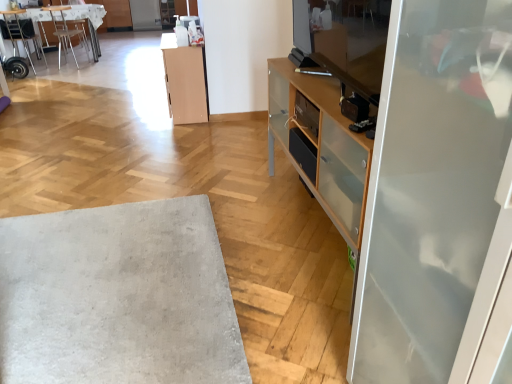
Question: Is clear glass screen door at upper center, which is the 1th screen door in back-to-front order, wider than wooden textured desk at upper left?

Choices:
 (A) yes
 (B) no

Answer: (A)

Question: From a real-world perspective, is clear glass screen door at upper center, which is the second screen door in right-to-left order, located beneath wooden textured desk at upper left?

Choices:
 (A) no
 (B) yes

Answer: (B)

Question: Is clear glass screen door at upper center, acting as the first screen door starting from the left, at the right side of wooden textured desk at upper left?

Choices:
 (A) no
 (B) yes

Answer: (B)

Question: Is clear glass screen door at upper center, which is the 1th screen door in back-to-front order, positioned beyond the bounds of wooden textured desk at upper left?

Choices:
 (A) yes
 (B) no

Answer: (A)

Question: Is clear glass screen door at upper center, marked as the 2th screen door in a front-to-back arrangement, beside wooden textured desk at upper left?

Choices:
 (A) no
 (B) yes

Answer: (A)

Question: Is wooden textured desk at upper left wider or thinner than metallic silver chair at upper left, the 2th chair positioned from the right?

Choices:
 (A) wide
 (B) thin

Answer: (A)

Question: Looking at the image, does wooden textured desk at upper left seem bigger or smaller compared to metallic silver chair at upper left, the 2th chair positioned from the right?

Choices:
 (A) big
 (B) small

Answer: (A)

Question: Considering their positions, is wooden textured desk at upper left located in front of or behind metallic silver chair at upper left, the first chair viewed from the left?

Choices:
 (A) behind
 (B) front

Answer: (A)

Question: Do you think wooden textured desk at upper left is within metallic silver chair at upper left, the 2th chair positioned from the right, or outside of it?

Choices:
 (A) inside
 (B) outside

Answer: (B)

Question: In terms of size, does metallic silver chair at upper left, which ranks as the first chair in right-to-left order, appear bigger or smaller than light wood cabinet at center?

Choices:
 (A) small
 (B) big

Answer: (A)

Question: From the image's perspective, is metallic silver chair at upper left, which ranks as the 2th chair in left-to-right order, positioned above or below light wood cabinet at center?

Choices:
 (A) below
 (B) above

Answer: (B)

Question: Is metallic silver chair at upper left, which ranks as the first chair in right-to-left order, wider or thinner than light wood cabinet at center?

Choices:
 (A) wide
 (B) thin

Answer: (A)

Question: Considering the relative positions of metallic silver chair at upper left, which ranks as the 2th chair in left-to-right order, and light wood cabinet at center in the image provided, is metallic silver chair at upper left, which ranks as the 2th chair in left-to-right order, to the left or to the right of light wood cabinet at center?

Choices:
 (A) right
 (B) left

Answer: (B)

Question: From a real-world perspective, is light wood cabinet at center positioned above or below metallic silver chair at upper left, the first chair viewed from the left?

Choices:
 (A) below
 (B) above

Answer: (A)

Question: Considering the positions of light wood cabinet at center and metallic silver chair at upper left, the 2th chair positioned from the right, in the image, is light wood cabinet at center bigger or smaller than metallic silver chair at upper left, the 2th chair positioned from the right,?

Choices:
 (A) small
 (B) big

Answer: (B)